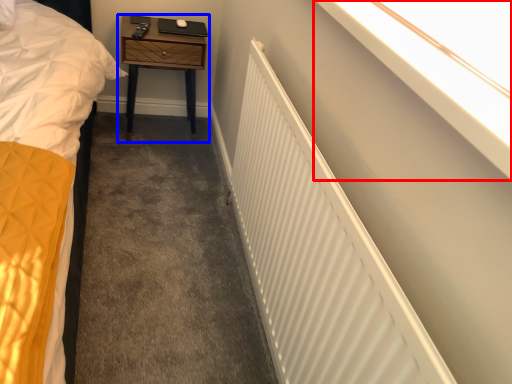
Question: Which object is closer to the camera taking this photo, window sill (highlighted by a red box) or nightstand (highlighted by a blue box)?

Choices:
 (A) window sill
 (B) nightstand

Answer: (A)